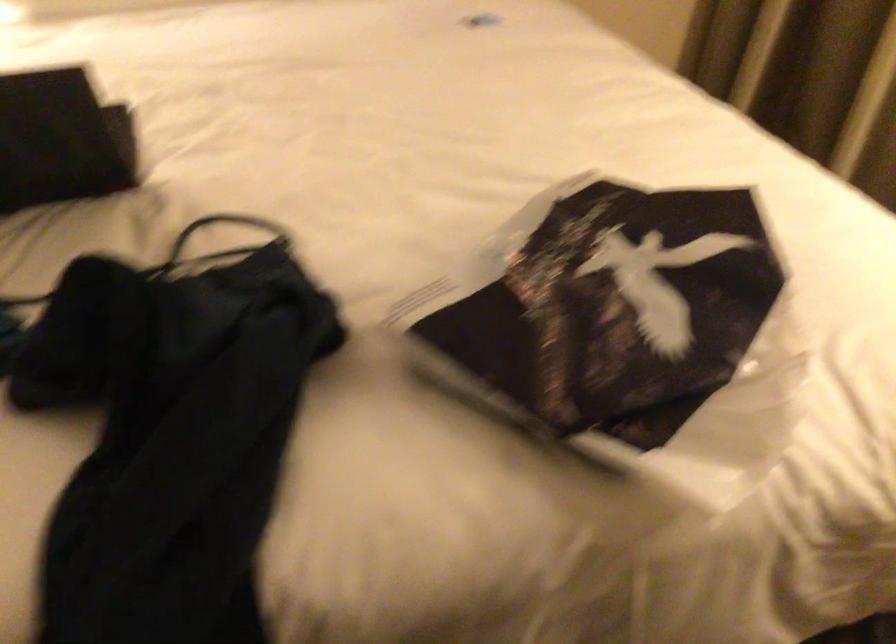
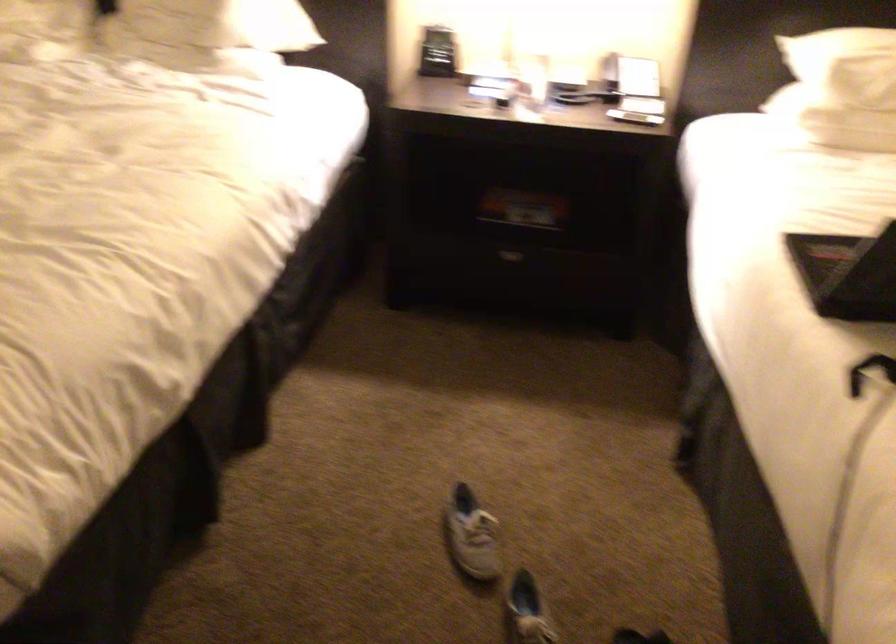
In a continuous first-person perspective shot, in which direction is the camera moving?

The cameraman moved toward left, backward.